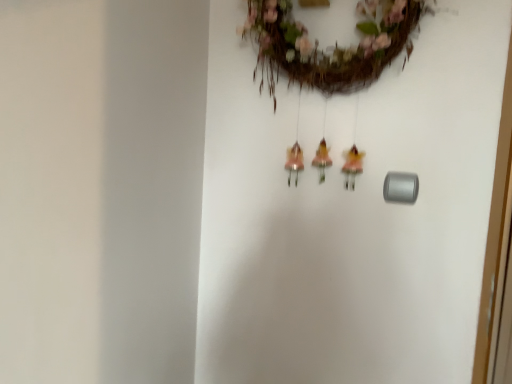
Identify the location of metallic shiny wind chime at upper center. The height and width of the screenshot is (384, 512). (332, 47).

The width and height of the screenshot is (512, 384). Describe the element at coordinates (332, 47) in the screenshot. I see `metallic shiny wind chime at upper center` at that location.

This screenshot has width=512, height=384. Identify the location of metallic shiny wind chime at upper center. (332, 47).